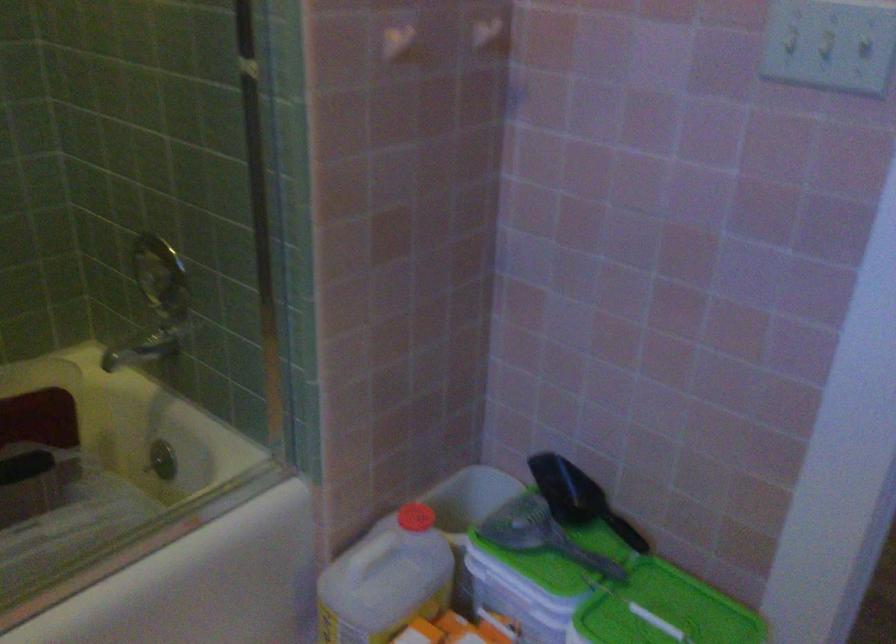
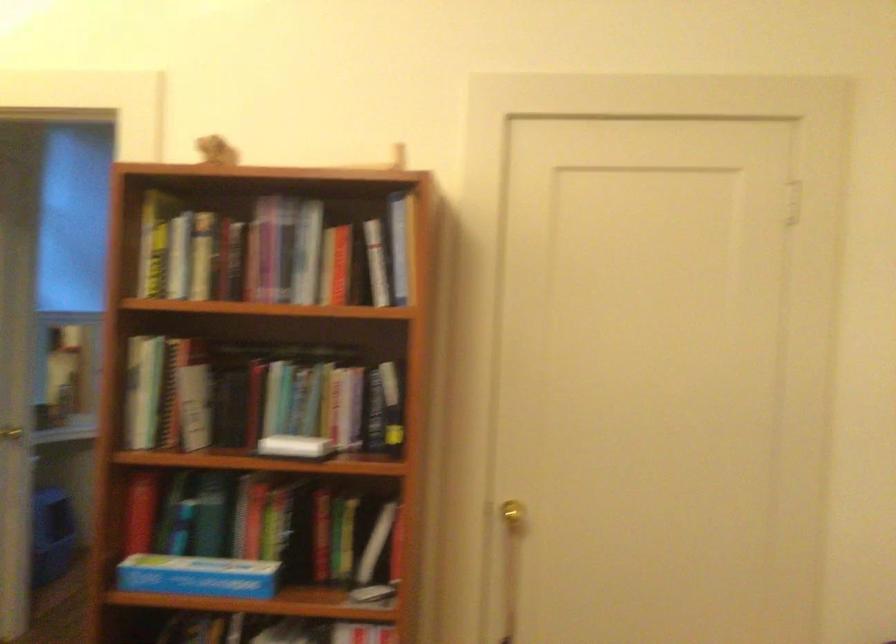
Question: I am providing you with two images of the same scene from different viewpoints. Please identify which objects are invisible in image2.

Choices:
 (A) Door handle
 (B) silver door knob
 (C) blue cardboard box
 (D) white wall hook

Answer: (D)